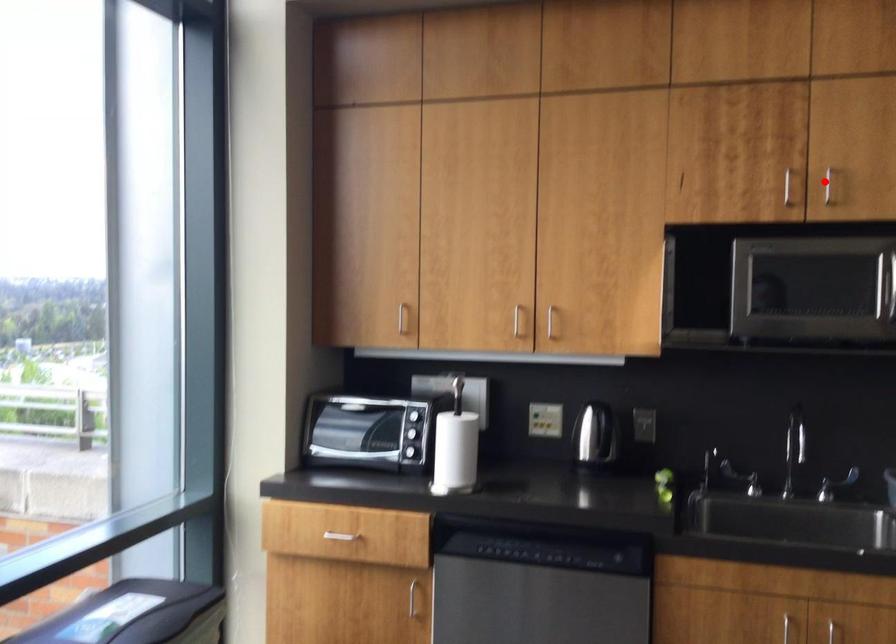
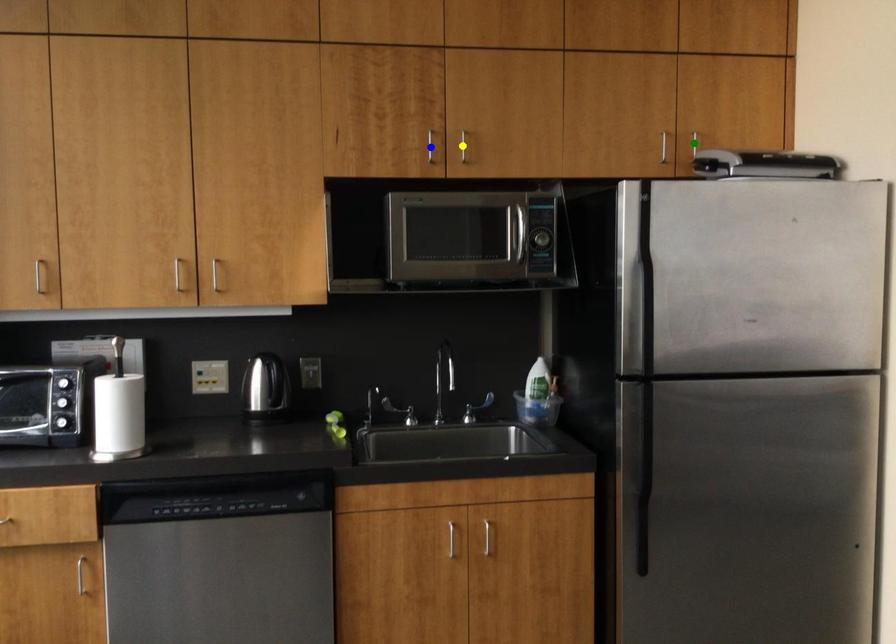
Question: I am providing you with two images of the same scene from different viewpoints. A red point is marked on the first image. You are given multiple points on the second image. In image 2, which mark is for the same physical point as the one in image 1?

Choices:
 (A) blue point
 (B) yellow point
 (C) green point

Answer: (B)